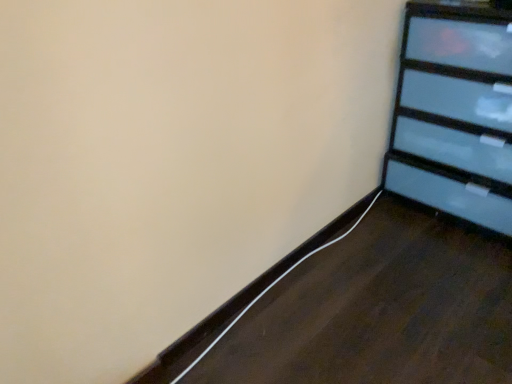
Question: Is white matte cable at lower left facing towards black glossy dresser at upper right?

Choices:
 (A) yes
 (B) no

Answer: (B)

Question: Is white matte cable at lower left behind black glossy dresser at upper right?

Choices:
 (A) no
 (B) yes

Answer: (B)

Question: Does white matte cable at lower left come in front of black glossy dresser at upper right?

Choices:
 (A) no
 (B) yes

Answer: (A)

Question: Is white matte cable at lower left smaller than black glossy dresser at upper right?

Choices:
 (A) no
 (B) yes

Answer: (B)

Question: Considering the relative sizes of white matte cable at lower left and black glossy dresser at upper right in the image provided, is white matte cable at lower left bigger than black glossy dresser at upper right?

Choices:
 (A) yes
 (B) no

Answer: (B)

Question: Is white matte cable at lower left positioned far away from black glossy dresser at upper right?

Choices:
 (A) no
 (B) yes

Answer: (A)

Question: Is black glossy dresser at upper right smaller than white matte cable at lower left?

Choices:
 (A) no
 (B) yes

Answer: (A)

Question: Does black glossy dresser at upper right have a lesser height compared to white matte cable at lower left?

Choices:
 (A) no
 (B) yes

Answer: (A)

Question: From a real-world perspective, is black glossy dresser at upper right positioned over white matte cable at lower left based on gravity?

Choices:
 (A) no
 (B) yes

Answer: (B)

Question: Is the depth of black glossy dresser at upper right less than that of white matte cable at lower left?

Choices:
 (A) yes
 (B) no

Answer: (A)

Question: Is black glossy dresser at upper right positioned far away from white matte cable at lower left?

Choices:
 (A) no
 (B) yes

Answer: (A)

Question: Is the position of black glossy dresser at upper right more distant than that of white matte cable at lower left?

Choices:
 (A) yes
 (B) no

Answer: (B)

Question: Is point (433, 43) positioned closer to the camera than point (339, 238)?

Choices:
 (A) farther
 (B) closer

Answer: (B)